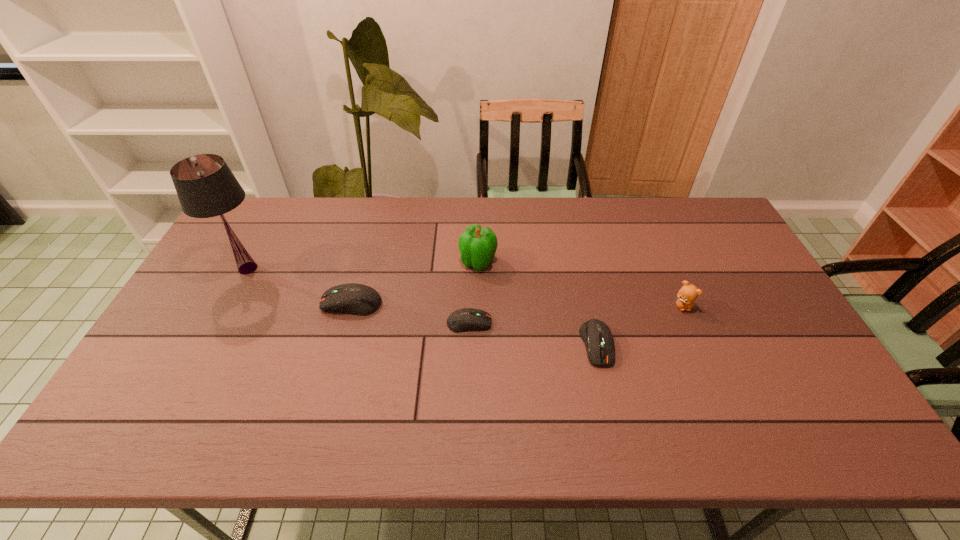
The width and height of the screenshot is (960, 540). I want to click on free spot between the rightmost computer equipment and the rightmost object, so pyautogui.click(x=639, y=325).

Where is `unoccupied position between the rightmost object and the shortest object`? The width and height of the screenshot is (960, 540). unoccupied position between the rightmost object and the shortest object is located at coordinates (576, 314).

I want to click on free space between the third tallest object and the shortest computer equipment, so click(576, 314).

Choose which object is the second nearest neighbor to the shortest object. Please provide its 2D coordinates. Your answer should be formatted as a tuple, i.e. [(x, y)], where the tuple contains the x and y coordinates of a point satisfying the conditions above.

[(359, 299)]

Where is `the fourth closest object to the shortest object`? This screenshot has height=540, width=960. the fourth closest object to the shortest object is located at coordinates (688, 293).

You are a GUI agent. You are given a task and a screenshot of the screen. Output one action in this format:
    pyautogui.click(x=<x>, y=<y>)
    Task: Click on the computer equipment that is the second closest to the shortest object
    The height and width of the screenshot is (540, 960).
    Given the screenshot: What is the action you would take?
    pyautogui.click(x=596, y=335)

Identify which computer equipment is the closest to the teddy bear. Please provide its 2D coordinates. Your answer should be formatted as a tuple, i.e. [(x, y)], where the tuple contains the x and y coordinates of a point satisfying the conditions above.

[(596, 335)]

What are the coordinates of `free location that satisfies the following two spatial constraints: 1. on the front side of the bell pepper; 2. on the button of the second computer equipment from right to left` in the screenshot? It's located at (478, 323).